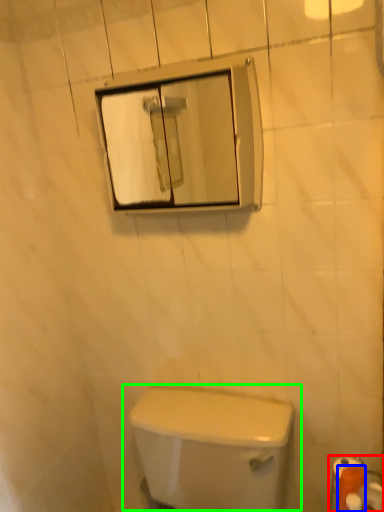
Question: Which object is positioned closest to toilet paper (highlighted by a red box)? Select from toilet paper (highlighted by a blue box) and toilet (highlighted by a green box).

Choices:
 (A) toilet paper
 (B) toilet

Answer: (A)